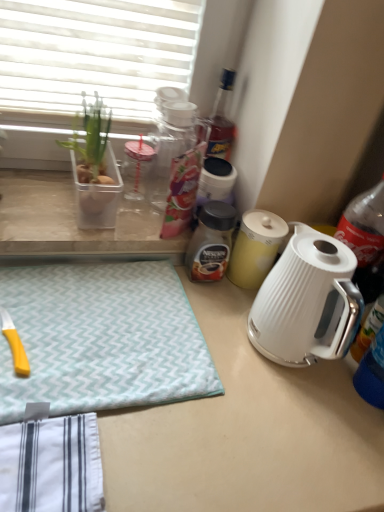
This screenshot has width=384, height=512. Identify the location of blank space to the left of clear plastic container at upper left. (39, 189).